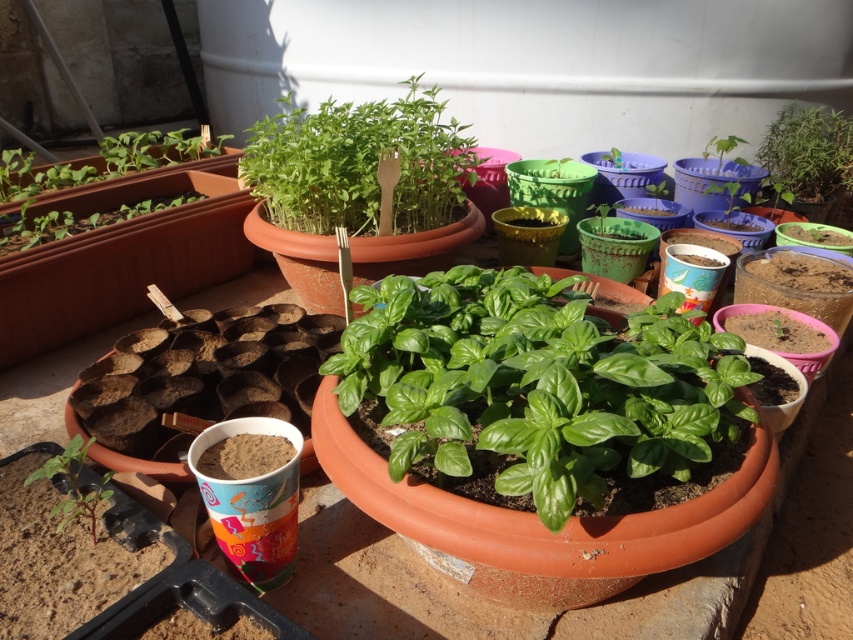
Question: Is green glossy basil at center closer to the viewer compared to green matte seedling at lower left?

Choices:
 (A) no
 (B) yes

Answer: (B)

Question: Is the position of green glossy basil at center more distant than that of green matte plant at upper right?

Choices:
 (A) yes
 (B) no

Answer: (B)

Question: Among these objects, which one is nearest to the camera?

Choices:
 (A) green matte plant at upper center
 (B) green matte plant at upper right

Answer: (A)

Question: Which object appears closest to the camera in this image?

Choices:
 (A) green glossy basil at center
 (B) green matte plant at upper center
 (C) green matte seedling at lower left
 (D) green matte plant at upper right

Answer: (A)

Question: Is green matte plant at upper center bigger than green matte seedling at lower left?

Choices:
 (A) yes
 (B) no

Answer: (A)

Question: Which point is closer to the camera taking this photo?

Choices:
 (A) 834,131
 (B) 96,509
 (C) 604,358

Answer: (C)